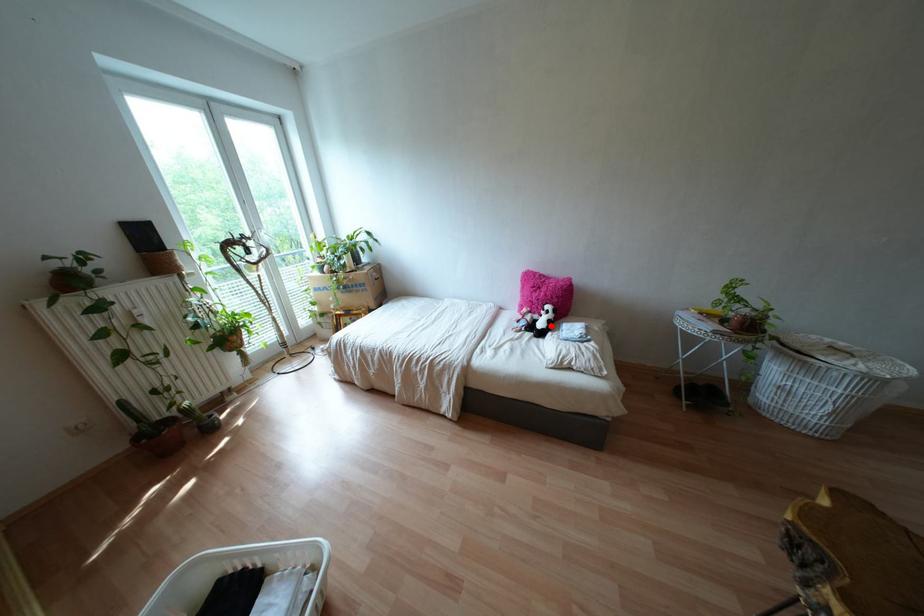
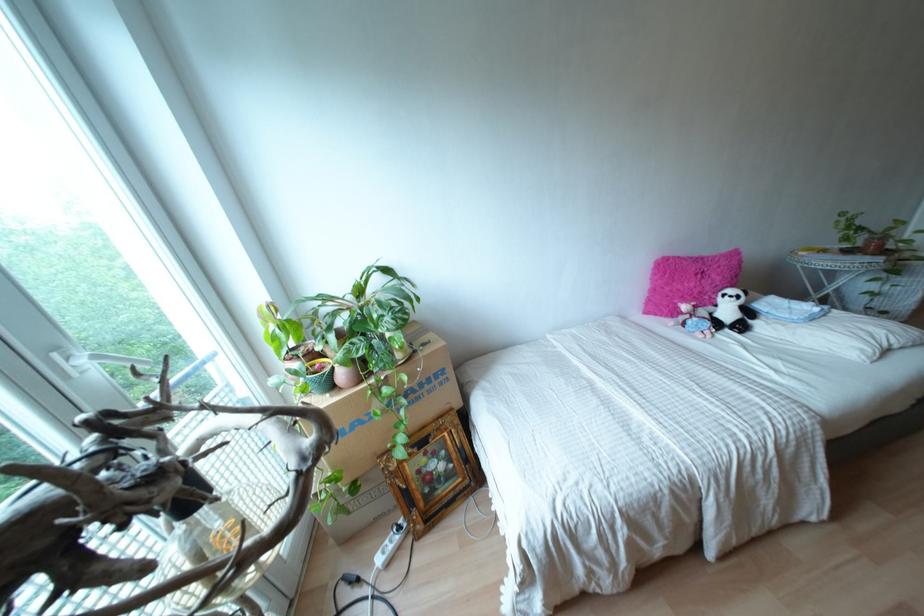
Locate, in the second image, the point that corresponds to the highlighted location in the first image.

(747, 312)